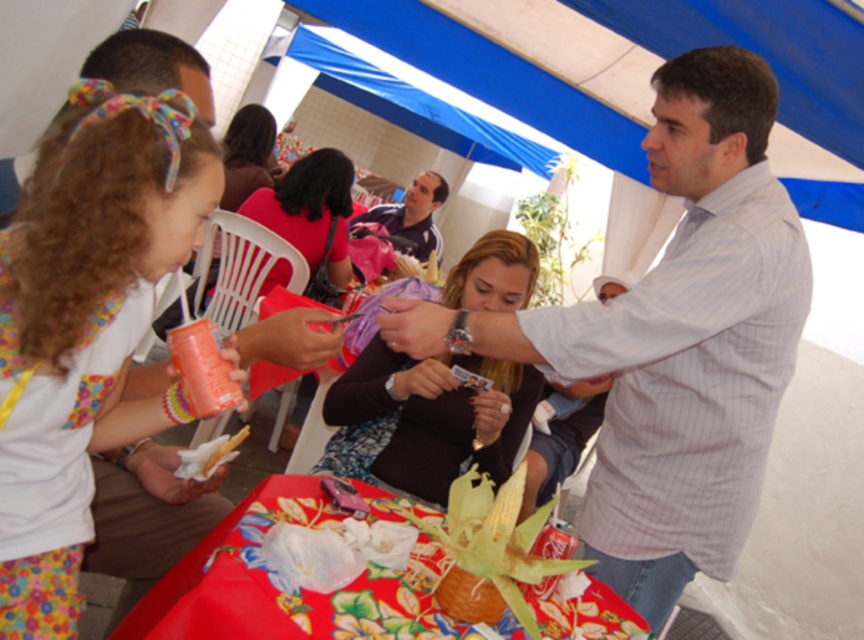
This screenshot has width=864, height=640. What do you see at coordinates (86, 326) in the screenshot?
I see `floral fabric dress at left` at bounding box center [86, 326].

Which is below, floral fabric dress at left or floral printed fabric at lower center?

floral printed fabric at lower center is below.

Describe the element at coordinates (86, 326) in the screenshot. I see `floral fabric dress at left` at that location.

The image size is (864, 640). Find the location of `floral fabric dress at left`. floral fabric dress at left is located at coordinates [86, 326].

Between point (267, 490) and point (286, 211), which one is positioned in front?

Point (267, 490) is more forward.

Is floral printed fabric at lower center thinner than matte pink shirt at center?

No, floral printed fabric at lower center is not thinner than matte pink shirt at center.

Who is more distant from viewer, (297, 497) or (348, 180)?

Point (348, 180)

Find the location of `floral printed fabric at lower center`. floral printed fabric at lower center is located at coordinates (256, 582).

Is floral fabric dress at left below matte brown sweater at center?

Actually, floral fabric dress at left is above matte brown sweater at center.

This screenshot has width=864, height=640. What are the coordinates of `floral fabric dress at left` in the screenshot? It's located at (86, 326).

Describe the element at coordinates (86, 326) in the screenshot. This screenshot has height=640, width=864. I see `floral fabric dress at left` at that location.

Image resolution: width=864 pixels, height=640 pixels. Identify the location of floral fabric dress at left. (86, 326).